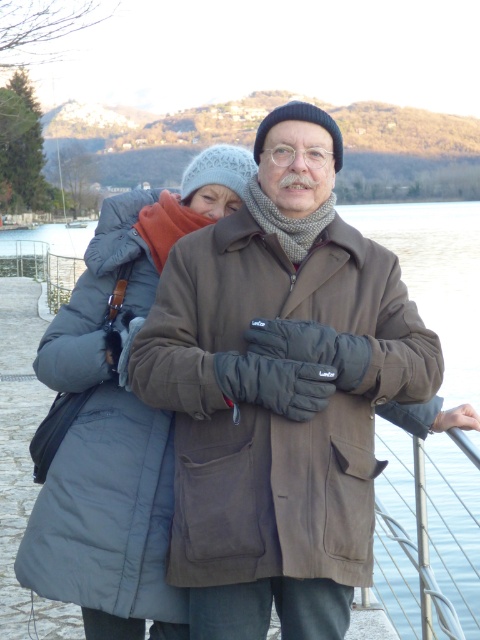
You are standing at the point with coordinates (279, 392) in the image. What object is located exactly at this point?

The brown suede coat at center is located exactly at point (279, 392).

You are a photographer trying to capture a photo of both individuals in the scene. You notice two points marked in the image at coordinates point (265,269) and point (190,189). Which point should you focus on to ensure both individuals are in the frame?

You should focus on point (265,269) because it is in front of point (190,189), ensuring both individuals are visible in the frame.

You are a photographer trying to capture a photo of both the brown suede coat at center and the gray puffy coat at center. Since both are at the center, how can you ensure both are fully visible in the photo?

The brown suede coat at center is below the gray puffy coat at center, so adjusting the camera angle to capture both the lower and upper parts of the scene will ensure both coats are visible.